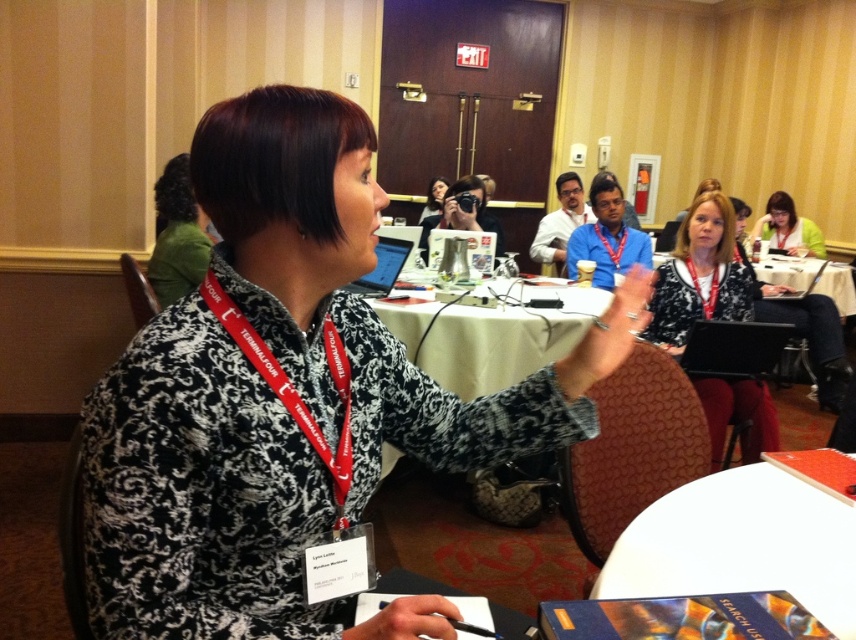
Can you confirm if red fabric lanyard at center is wider than green fabric shirt at upper right?

No, red fabric lanyard at center is not wider than green fabric shirt at upper right.

Is red fabric lanyard at center closer to camera compared to green fabric shirt at upper right?

Yes, red fabric lanyard at center is in front of green fabric shirt at upper right.

Which is behind, point (302, 429) or point (782, 202)?

Positioned behind is point (782, 202).

Locate an element on the screen. The image size is (856, 640). red fabric lanyard at center is located at coordinates (293, 387).

Does white paper at lower right have a larger size compared to green fabric shirt at upper right?

No.

Between point (658, 509) and point (794, 240), which one is positioned behind?

Positioned behind is point (794, 240).

Is point (637, 593) closer to viewer compared to point (774, 205)?

Yes, it is.

Locate an element on the screen. white paper at lower right is located at coordinates (742, 544).

From the picture: Can you confirm if white fabric table at center is positioned to the right of red fabric lanyard at center?

Yes, white fabric table at center is to the right of red fabric lanyard at center.

Based on the photo, is the position of white fabric table at center more distant than that of red fabric lanyard at center?

Yes, white fabric table at center is further from the viewer.

Where is `white fabric table at center`? Image resolution: width=856 pixels, height=640 pixels. white fabric table at center is located at coordinates (490, 337).

Find the location of a particular element. white fabric table at center is located at coordinates tap(490, 337).